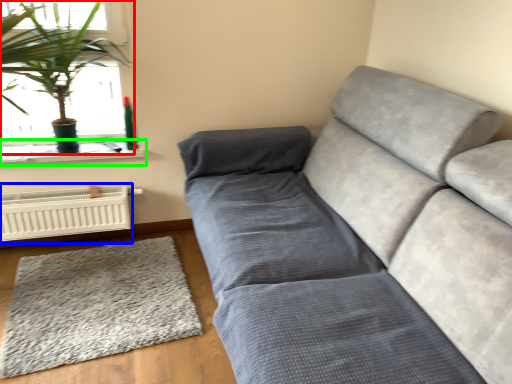
Question: Which is farther away from houseplant (highlighted by a red box)? heater (highlighted by a blue box) or window sill (highlighted by a green box)?

Choices:
 (A) heater
 (B) window sill

Answer: (A)